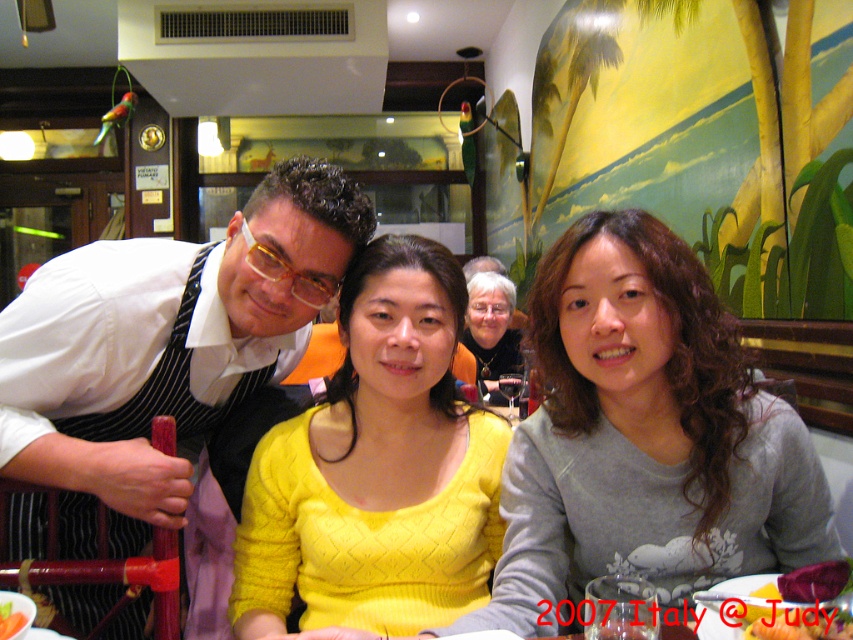
Question: Which point appears farthest from the camera in this image?

Choices:
 (A) (282, 625)
 (B) (656, 563)

Answer: (A)

Question: Which of these objects is positioned closest to the gray matte sweater at center?

Choices:
 (A) beetroot smoothie at lower right
 (B) matte black hair at center
 (C) smooth tomato at center

Answer: (A)

Question: In this image, where is white shirt at left located relative to yellow knitted sweater at center?

Choices:
 (A) below
 (B) above

Answer: (B)

Question: Can you confirm if white shirt at left is positioned to the left of matte black hair at center?

Choices:
 (A) no
 (B) yes

Answer: (B)

Question: Does yellow knitted sweater at center appear over smooth tomato at center?

Choices:
 (A) no
 (B) yes

Answer: (B)

Question: Which point is closer to the camera?

Choices:
 (A) smooth tomato at center
 (B) gray matte sweater at center

Answer: (A)